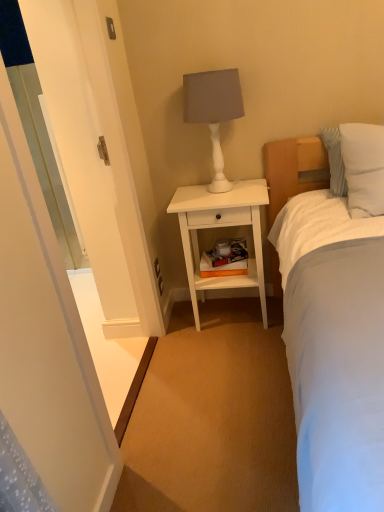
Describe the element at coordinates (363, 168) in the screenshot. I see `white soft pillow at upper right` at that location.

Where is `white soft pillow at upper right`? The height and width of the screenshot is (512, 384). white soft pillow at upper right is located at coordinates (363, 168).

In order to face white matte table lamp at upper center, should I rotate leftwards or rightwards?

To face it directly, rotate right by 2.958 degrees.

The height and width of the screenshot is (512, 384). I want to click on white matte table lamp at upper center, so click(x=213, y=111).

Describe the element at coordinates (46, 341) in the screenshot. The height and width of the screenshot is (512, 384). I see `white glossy screen door at left` at that location.

Where is `white matte nightstand at center`? The image size is (384, 512). white matte nightstand at center is located at coordinates (219, 227).

Is white matte table lamp at upper center to the right of white soft pillow at upper right from the viewer's perspective?

No.

Can you see white matte table lamp at upper center touching white soft pillow at upper right?

No, white matte table lamp at upper center is not touching white soft pillow at upper right.

From the image's perspective, would you say white matte table lamp at upper center is positioned over white soft pillow at upper right?

Yes, from the image's perspective, white matte table lamp at upper center is above white soft pillow at upper right.

Is white matte table lamp at upper center oriented towards white soft pillow at upper right?

No, white matte table lamp at upper center does not turn towards white soft pillow at upper right.

Consider the image. Which is less distant, (191, 216) or (23, 336)?

Positioned in front is point (23, 336).

In terms of width, does white matte nightstand at center look wider or thinner when compared to white glossy screen door at left?

Considering their sizes, white matte nightstand at center looks broader than white glossy screen door at left.

Is white matte nightstand at center bigger or smaller than white glossy screen door at left?

In the image, white matte nightstand at center appears to be smaller than white glossy screen door at left.

Does white glossy screen door at left have a greater width compared to white matte table lamp at upper center?

No, white glossy screen door at left is not wider than white matte table lamp at upper center.

From the image's perspective, which one is positioned lower, white glossy screen door at left or white matte table lamp at upper center?

white glossy screen door at left is shown below in the image.

Which is closer, (74, 510) or (214, 121)?

A: The point (74, 510) is more forward.

In terms of height, does white glossy screen door at left look taller or shorter compared to white matte table lamp at upper center?

white glossy screen door at left is taller than white matte table lamp at upper center.

How different are the orientations of white matte nightstand at center and white matte table lamp at upper center in degrees?

The angle between the facing direction of white matte nightstand at center and the facing direction of white matte table lamp at upper center is 1.98 degrees.

Relative to white matte table lamp at upper center, is white matte nightstand at center in front or behind?

Visually, white matte nightstand at center is located behind white matte table lamp at upper center.

From a real-world perspective, which is physically below, white matte nightstand at center or white matte table lamp at upper center?

From a 3D spatial view, white matte nightstand at center is below.

At what (x,y) coordinates should I click in order to perform the action: click on nightstand below the white matte table lamp at upper center (from a real-world perspective). Please return your answer as a coordinate pair (x, y). Image resolution: width=384 pixels, height=512 pixels. Looking at the image, I should click on (219, 227).

Is white matte table lamp at upper center not close to white glossy screen door at left?

Indeed, white matte table lamp at upper center is not near white glossy screen door at left.

From a real-world perspective, is white matte table lamp at upper center physically below white glossy screen door at left?

No.

Which is in front, white matte table lamp at upper center or white glossy screen door at left?

white glossy screen door at left is closer to the camera.

Is white matte table lamp at upper center situated inside white matte nightstand at center or outside?

white matte table lamp at upper center is outside white matte nightstand at center.

From the image's perspective, which object appears higher, white matte table lamp at upper center or white matte nightstand at center?

From the image's view, white matte table lamp at upper center is above.

Is white matte table lamp at upper center not close to white matte nightstand at center?

No.

In terms of width, does white glossy screen door at left look wider or thinner when compared to white matte nightstand at center?

white glossy screen door at left is thinner than white matte nightstand at center.

Does white glossy screen door at left appear on the left side of white matte nightstand at center?

Correct, you'll find white glossy screen door at left to the left of white matte nightstand at center.

Is white matte nightstand at center surrounded by white glossy screen door at left?

That's incorrect, white matte nightstand at center is not inside white glossy screen door at left.

At what (x,y) coordinates should I click in order to perform the action: click on pillow below the white matte table lamp at upper center (from a real-world perspective). Please return your answer as a coordinate pair (x, y). Image resolution: width=384 pixels, height=512 pixels. Looking at the image, I should click on (363, 168).

At what (x,y) coordinates should I click in order to perform the action: click on screen door lying on the left of white matte nightstand at center. Please return your answer as a coordinate pair (x, y). This screenshot has height=512, width=384. Looking at the image, I should click on (46, 341).

Based on their spatial positions, is white matte table lamp at upper center or white matte nightstand at center closer to white glossy screen door at left?

Among the two, white matte nightstand at center is located nearer to white glossy screen door at left.

From the image, which object appears to be nearer to white soft pillow at upper right, white glossy screen door at left or white matte table lamp at upper center?

white matte table lamp at upper center is positioned closer to the anchor white soft pillow at upper right.

Which object lies further to the anchor point white soft pillow at upper right, white glossy screen door at left or white matte nightstand at center?

Based on the image, white glossy screen door at left appears to be further to white soft pillow at upper right.

Estimate the real-world distances between objects in this image. Which object is closer to white matte table lamp at upper center, white glossy screen door at left or white matte nightstand at center?

white matte nightstand at center is positioned closer to the anchor white matte table lamp at upper center.

Looking at the image, which one is located further to white matte table lamp at upper center, white matte nightstand at center or white soft pillow at upper right?

white soft pillow at upper right is further to white matte table lamp at upper center.

Based on their spatial positions, is white glossy screen door at left or white soft pillow at upper right further from white matte table lamp at upper center?

white glossy screen door at left lies further to white matte table lamp at upper center than the other object.

Based on their spatial positions, is white soft pillow at upper right or white glossy screen door at left further from white matte nightstand at center?

Based on the image, white glossy screen door at left appears to be further to white matte nightstand at center.

Estimate the real-world distances between objects in this image. Which object is closer to white matte nightstand at center, white matte table lamp at upper center or white glossy screen door at left?

The object closer to white matte nightstand at center is white matte table lamp at upper center.

The height and width of the screenshot is (512, 384). I want to click on table lamp located between white glossy screen door at left and white soft pillow at upper right in the left-right direction, so click(213, 111).

Image resolution: width=384 pixels, height=512 pixels. What are the coordinates of `nightstand located between white glossy screen door at left and white soft pillow at upper right in the left-right direction` in the screenshot? It's located at (219, 227).

I want to click on nightstand between white matte table lamp at upper center and white soft pillow at upper right, so click(219, 227).

Locate an element on the screen. Image resolution: width=384 pixels, height=512 pixels. table lamp between white glossy screen door at left and white matte nightstand at center in the front-back direction is located at coordinates (213, 111).